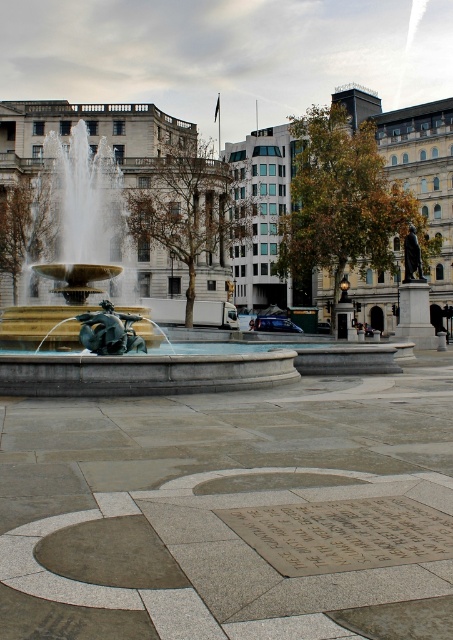
Who is positioned more to the right, gold polished stone fountain at center or bronze plaque at center?

From the viewer's perspective, bronze plaque at center appears more on the right side.

Who is more forward, (x=72, y=132) or (x=409, y=524)?

Point (x=409, y=524) is more forward.

Is point (114, 384) closer to camera compared to point (342, 532)?

No.

At what (x,y) coordinates should I click in order to perform the action: click on gold polished stone fountain at center. Please return your answer as a coordinate pair (x, y). Looking at the image, I should click on (97, 307).